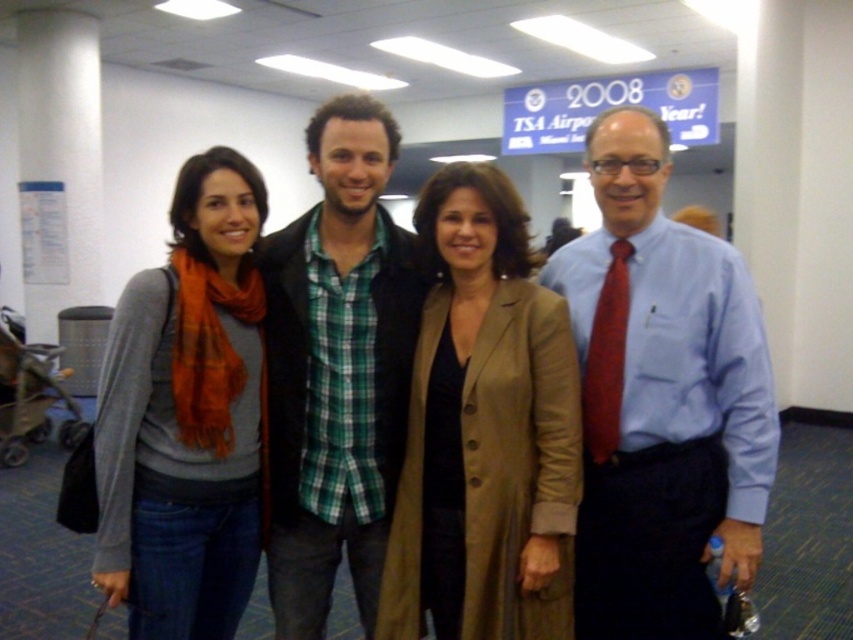
Image resolution: width=853 pixels, height=640 pixels. Identify the location of matte blue shirt at center. (660, 400).

Can you confirm if matte blue shirt at center is shorter than green plaid shirt at center?

Yes, matte blue shirt at center is shorter than green plaid shirt at center.

Does point (637, 176) come farther from viewer compared to point (270, 417)?

No.

Where is `matte blue shirt at center`? The width and height of the screenshot is (853, 640). matte blue shirt at center is located at coordinates (660, 400).

Which of these two, matte blue shirt at center or matte brown coat at center, stands taller?

matte blue shirt at center is taller.

Is point (630, 216) farther from camera compared to point (502, 324)?

That is False.

In order to click on matte blue shirt at center in this screenshot , I will do `click(660, 400)`.

Can you confirm if matte brown coat at center is positioned to the left of green plaid shirt at center?

In fact, matte brown coat at center is to the right of green plaid shirt at center.

Is point (515, 577) closer to camera compared to point (368, 244)?

Yes, point (515, 577) is in front of point (368, 244).

Does point (538, 481) lie in front of point (328, 496)?

That is True.

Identify the location of matte brown coat at center. (485, 432).